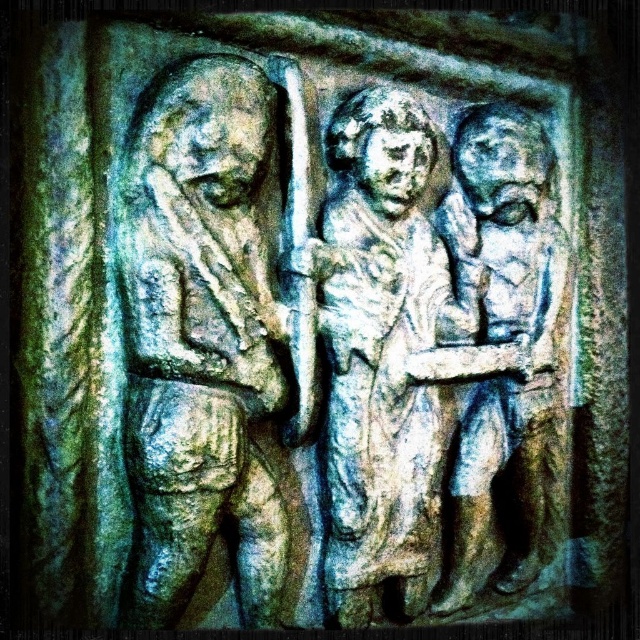
Can you confirm if carved stone figures at center is positioned to the left of carved stone figure at right?

Yes, carved stone figures at center is to the left of carved stone figure at right.

In the scene shown: Who is shorter, carved stone figures at center or carved stone figure at right?

With less height is carved stone figure at right.

Who is more distant from viewer, (438, 486) or (518, 445)?

The point (518, 445) is more distant.

Find the location of `carved stone figures at center`. carved stone figures at center is located at coordinates (392, 362).

Which is behind, point (161, 301) or point (419, 458)?

The point (419, 458) is more distant.

Does point (125, 294) come closer to viewer compared to point (371, 476)?

Yes, point (125, 294) is in front of point (371, 476).

What do you see at coordinates (204, 344) in the screenshot?
I see `carved stone figure at left` at bounding box center [204, 344].

The width and height of the screenshot is (640, 640). Find the location of `carved stone figure at left`. carved stone figure at left is located at coordinates (204, 344).

Looking at this image, is carved stone figure at left to the left of carved stone figure at right from the viewer's perspective?

Yes, carved stone figure at left is to the left of carved stone figure at right.

Can you confirm if carved stone figure at left is positioned below carved stone figure at right?

Incorrect, carved stone figure at left is not positioned below carved stone figure at right.

Is point (184, 145) positioned before point (522, 392)?

Yes, point (184, 145) is in front of point (522, 392).

Image resolution: width=640 pixels, height=640 pixels. In order to click on carved stone figure at left in this screenshot , I will do `click(204, 344)`.